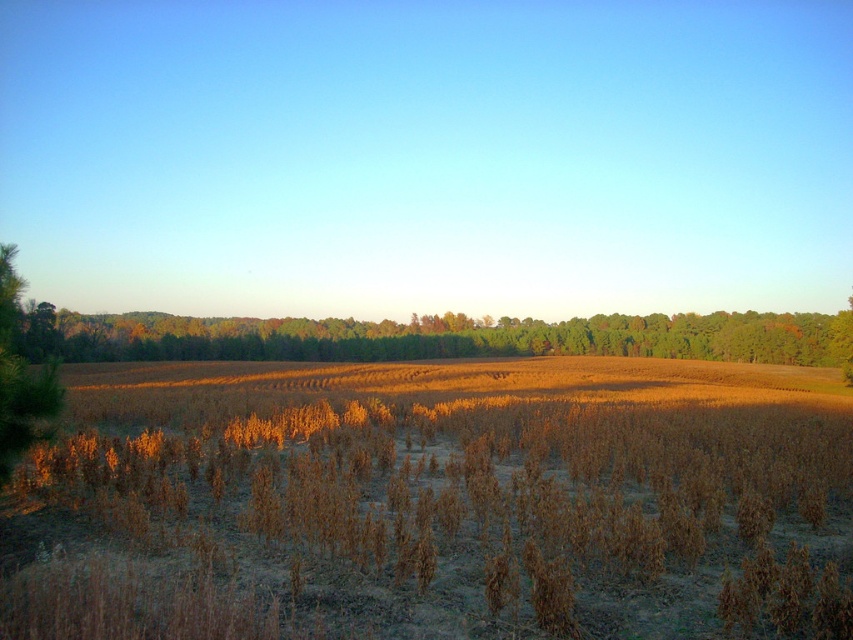
Question: Which object is positioned closest to the brown dry wheat at center?

Choices:
 (A) brown textured field at center
 (B) green matte tree at left

Answer: (B)

Question: Can you confirm if brown dry wheat at center is bigger than brown textured field at center?

Choices:
 (A) yes
 (B) no

Answer: (B)

Question: Which point is farther from the camera taking this photo?

Choices:
 (A) (157, 548)
 (B) (753, 330)

Answer: (B)

Question: Which of the following is the closest to the observer?

Choices:
 (A) (778, 332)
 (B) (718, 404)

Answer: (B)

Question: Does brown dry wheat at center have a lesser width compared to brown textured field at center?

Choices:
 (A) yes
 (B) no

Answer: (A)

Question: Can you confirm if brown textured field at center is positioned below green matte tree at left?

Choices:
 (A) yes
 (B) no

Answer: (A)